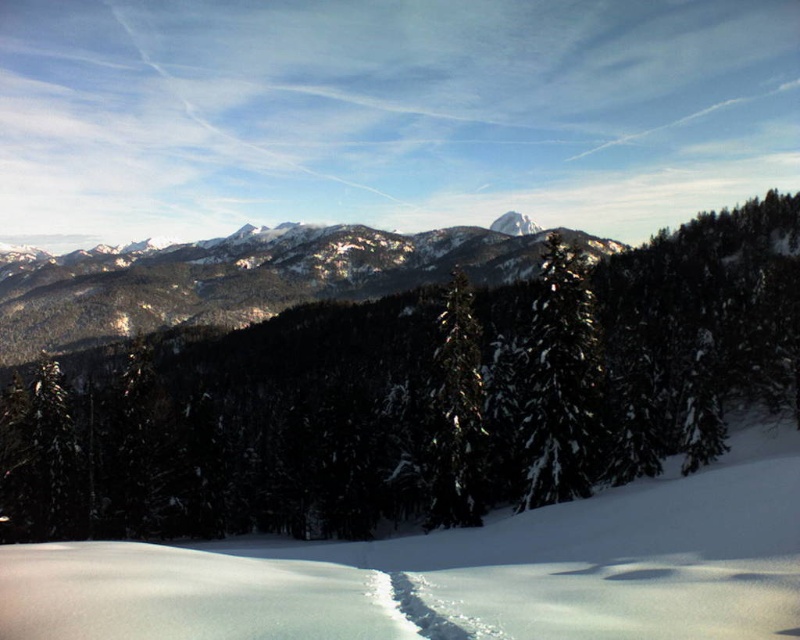
You are an explorer trying to cross the snow in the winter landscape. You see the white snow at center and the green glossy tree at center. Which one is larger in size?

The white snow at center is bigger than the green glossy tree at center according to the description.